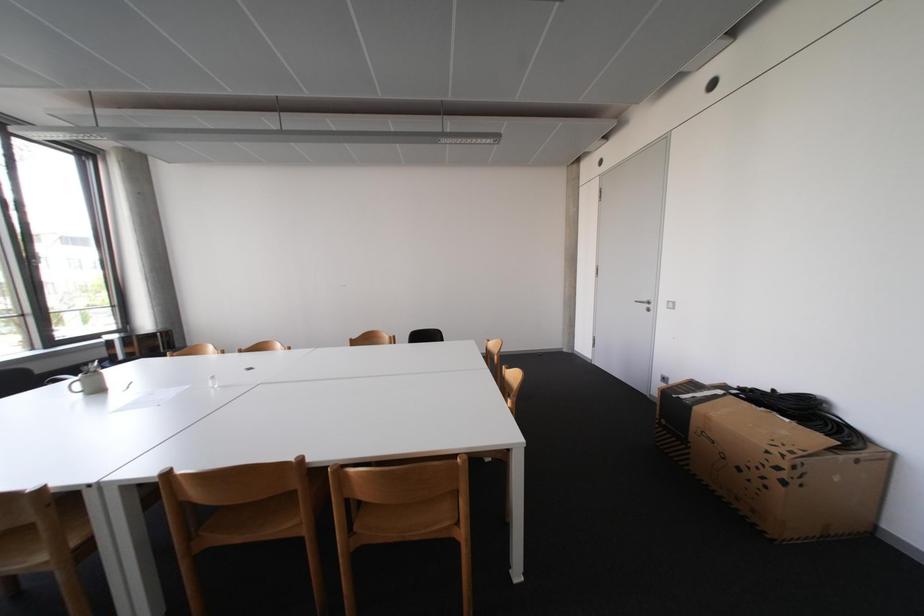
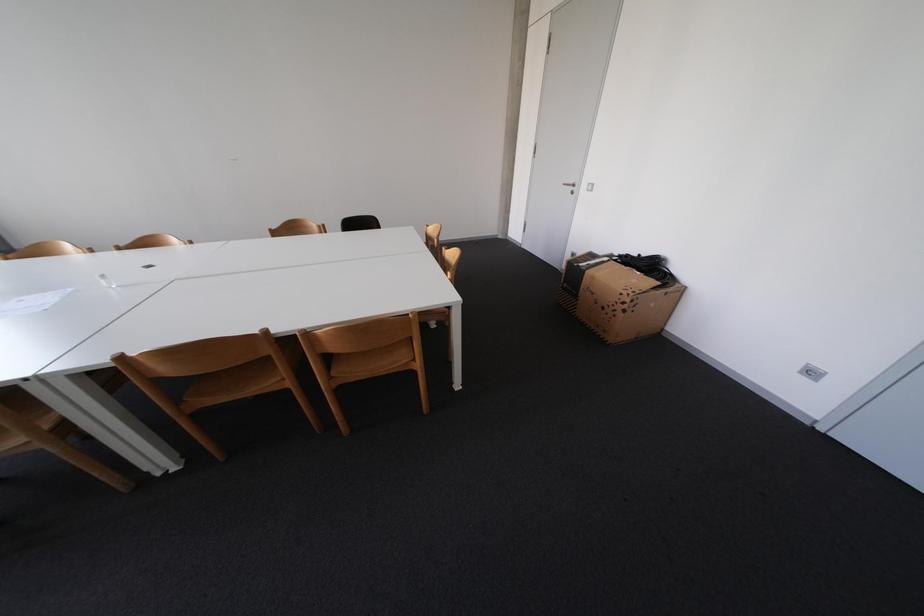
Question: Based on the continuous images, in which direction is the camera rotating? Reply with the corresponding letter.

Choices:
 (A) Left
 (B) Right
 (C) Up
 (D) Down

Answer: (D)